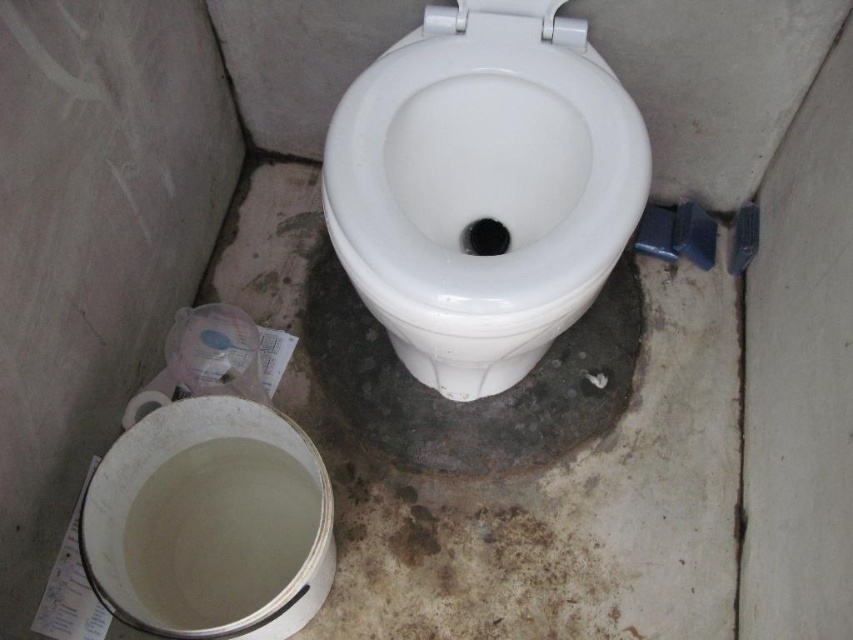
Does white glossy toilet bowl at center have a smaller size compared to white glossy toilet bowl at lower left?

Incorrect, white glossy toilet bowl at center is not smaller in size than white glossy toilet bowl at lower left.

The width and height of the screenshot is (853, 640). What do you see at coordinates (483, 188) in the screenshot?
I see `white glossy toilet bowl at center` at bounding box center [483, 188].

Find the location of a particular element. The width and height of the screenshot is (853, 640). white glossy toilet bowl at center is located at coordinates (483, 188).